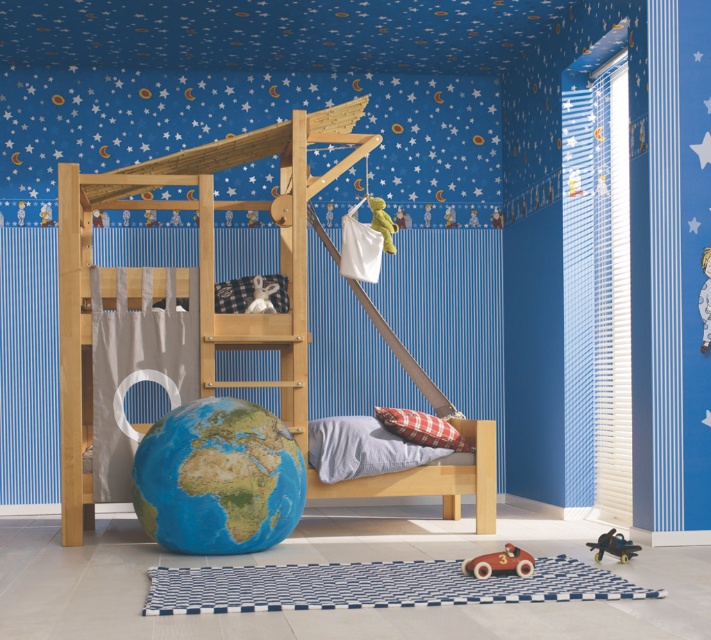
Can you confirm if soft yellow plush at center is positioned to the right of white fabric stuffed animal at center?

Yes, soft yellow plush at center is to the right of white fabric stuffed animal at center.

Between point (385, 227) and point (267, 308), which one is positioned behind?

The point (385, 227) is more distant.

Image resolution: width=711 pixels, height=640 pixels. Find the location of `soft yellow plush at center`. soft yellow plush at center is located at coordinates (383, 221).

How distant is metallic black airplane at lower right from white fabric stuffed animal at center?

metallic black airplane at lower right and white fabric stuffed animal at center are 7.58 feet apart.

Which is in front, point (597, 545) or point (256, 289)?

Point (597, 545)

Locate an element on the screen. metallic black airplane at lower right is located at coordinates (614, 545).

Can you confirm if earth globe at center is positioned below metallic black airplane at lower right?

Incorrect, earth globe at center is not positioned below metallic black airplane at lower right.

The image size is (711, 640). In order to click on earth globe at center in this screenshot , I will do `click(218, 477)`.

Find the location of `earth globe at center`. earth globe at center is located at coordinates (218, 477).